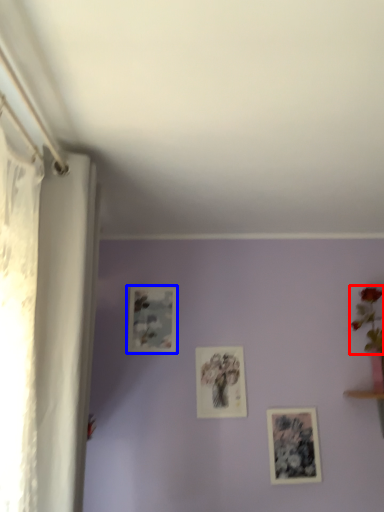
Question: Which object appears farthest to the camera in this image, floral arrangement (highlighted by a red box) or picture frame (highlighted by a blue box)?

Choices:
 (A) floral arrangement
 (B) picture frame

Answer: (B)